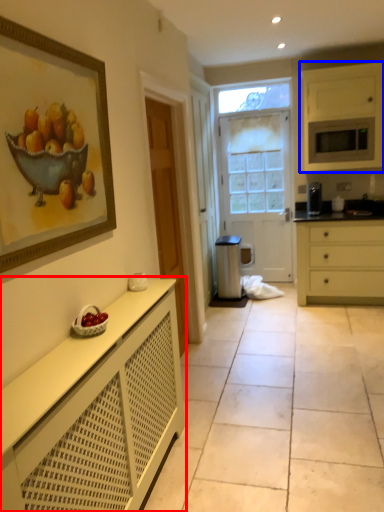
Question: Among these objects, which one is farthest to the camera, cabinetry (highlighted by a red box) or cabinetry (highlighted by a blue box)?

Choices:
 (A) cabinetry
 (B) cabinetry

Answer: (B)